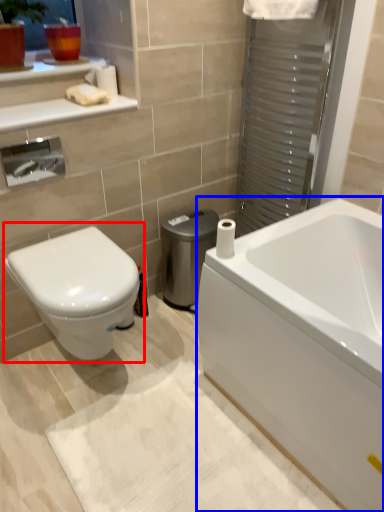
Question: Which of the following is the farthest to the observer, toilet (highlighted by a red box) or bathtub (highlighted by a blue box)?

Choices:
 (A) toilet
 (B) bathtub

Answer: (A)